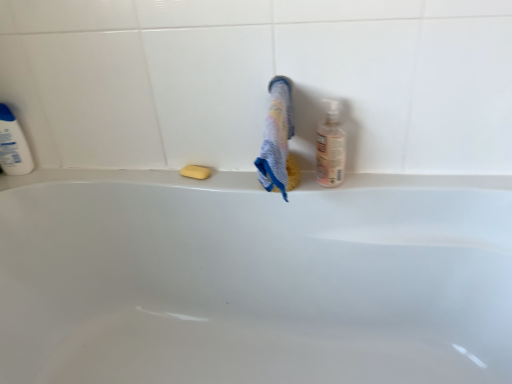
Question: Can you confirm if multicolored textured towel at center is wider than yellow matte soap at center?

Choices:
 (A) no
 (B) yes

Answer: (B)

Question: Is multicolored textured towel at center further to camera compared to yellow matte soap at center?

Choices:
 (A) yes
 (B) no

Answer: (B)

Question: Is multicolored textured towel at center not near yellow matte soap at center?

Choices:
 (A) yes
 (B) no

Answer: (B)

Question: From the image's perspective, would you say multicolored textured towel at center is positioned over yellow matte soap at center?

Choices:
 (A) yes
 (B) no

Answer: (A)

Question: Is multicolored textured towel at center smaller than yellow matte soap at center?

Choices:
 (A) no
 (B) yes

Answer: (A)

Question: Can you confirm if multicolored textured towel at center is positioned to the right of yellow matte soap at center?

Choices:
 (A) no
 (B) yes

Answer: (B)

Question: Considering the relative positions of white glossy bathtub at center and translucent plastic bottle at right, the 1th cleaning product viewed from the right, in the image provided, is white glossy bathtub at center to the right of translucent plastic bottle at right, the 1th cleaning product viewed from the right, from the viewer's perspective?

Choices:
 (A) yes
 (B) no

Answer: (B)

Question: Would you say white glossy bathtub at center contains translucent plastic bottle at right, the 2th cleaning product in the left-to-right sequence?

Choices:
 (A) no
 (B) yes

Answer: (A)

Question: From a real-world perspective, is white glossy bathtub at center on top of translucent plastic bottle at right, which is counted as the first cleaning product, starting from the front?

Choices:
 (A) yes
 (B) no

Answer: (B)

Question: From the image's perspective, is white glossy bathtub at center below translucent plastic bottle at right, the 1th cleaning product viewed from the right?

Choices:
 (A) no
 (B) yes

Answer: (B)

Question: Considering the relative sizes of white glossy bathtub at center and translucent plastic bottle at right, which is counted as the first cleaning product, starting from the front, in the image provided, is white glossy bathtub at center thinner than translucent plastic bottle at right, which is counted as the first cleaning product, starting from the front,?

Choices:
 (A) yes
 (B) no

Answer: (B)

Question: Can you see white glossy bathtub at center touching translucent plastic bottle at right, which is counted as the first cleaning product, starting from the front?

Choices:
 (A) yes
 (B) no

Answer: (B)

Question: From the image's perspective, is translucent plastic bottle at right, the 2th cleaning product in the left-to-right sequence, located above white plastic bottle at left, the 2th cleaning product in the right-to-left sequence?

Choices:
 (A) no
 (B) yes

Answer: (A)